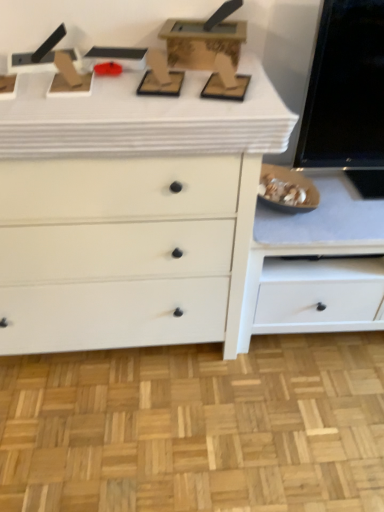
Locate an element on the screen. The height and width of the screenshot is (512, 384). vacant region above white matte counter top at upper center (from a real-world perspective) is located at coordinates (147, 78).